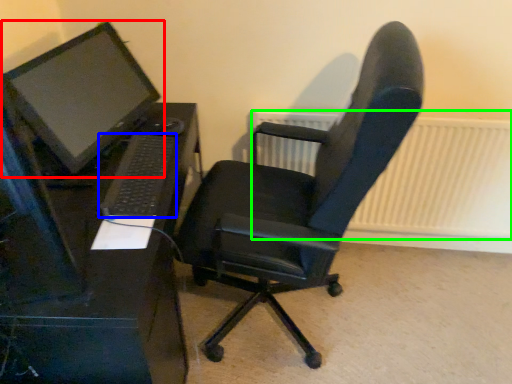
Question: Which object is the closest to the computer monitor (highlighted by a red box)? Choose among these: computer keyboard (highlighted by a blue box) or radiator (highlighted by a green box).

Choices:
 (A) computer keyboard
 (B) radiator

Answer: (A)